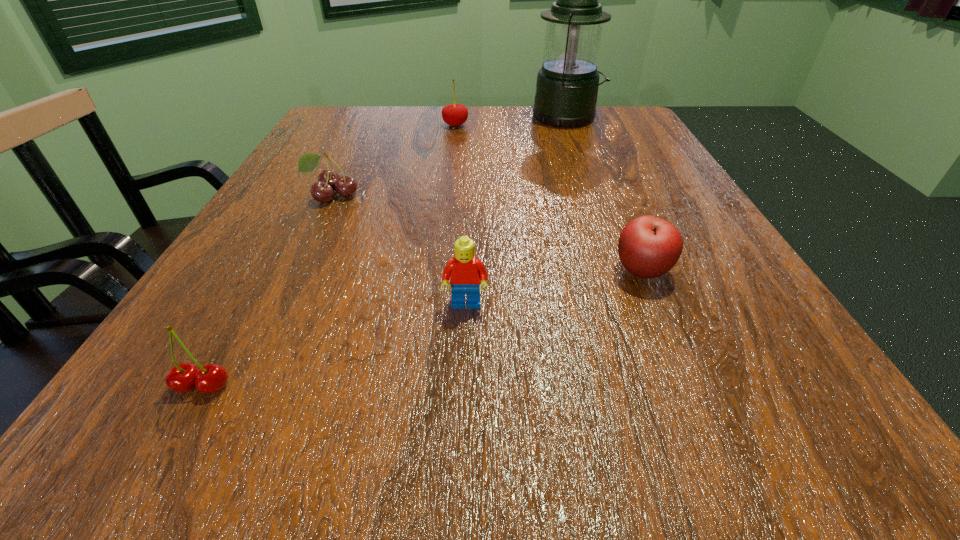
Where is `free location located on the right of the apple`? free location located on the right of the apple is located at coordinates (704, 271).

Where is `free space located on the leaves of the second nearest cherry`? This screenshot has width=960, height=540. free space located on the leaves of the second nearest cherry is located at coordinates (299, 263).

Locate an element on the screen. This screenshot has height=540, width=960. lantern located in the far edge section of the desktop is located at coordinates (567, 84).

Where is `cherry at the far edge`? cherry at the far edge is located at coordinates (454, 114).

This screenshot has width=960, height=540. Identify the location of object present at the near edge. (211, 378).

At what (x,y) coordinates should I click in order to perform the action: click on lantern that is at the right edge. Please return your answer as a coordinate pair (x, y). The image size is (960, 540). Looking at the image, I should click on (567, 84).

Locate an element on the screen. This screenshot has width=960, height=540. apple located in the right edge section of the desktop is located at coordinates (649, 247).

This screenshot has height=540, width=960. I want to click on object that is at the near left corner, so click(x=211, y=378).

Find the location of a particular element. This screenshot has width=960, height=540. object that is at the far right corner is located at coordinates (567, 84).

The width and height of the screenshot is (960, 540). I want to click on free space at the far edge of the desktop, so click(x=470, y=123).